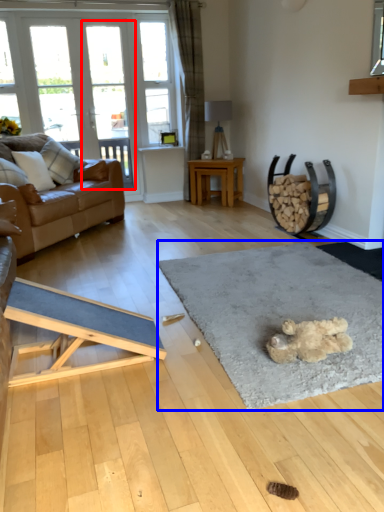
Question: Which point is closer to the camera, screen door (highlighted by a red box) or mat (highlighted by a blue box)?

Choices:
 (A) screen door
 (B) mat

Answer: (B)